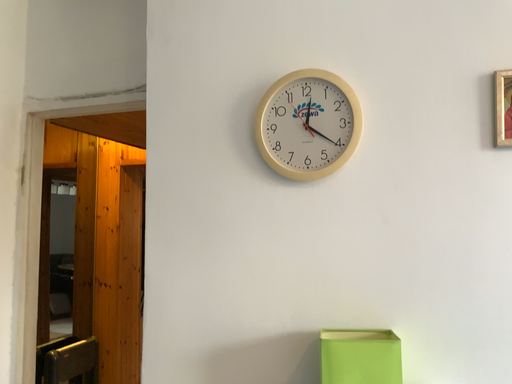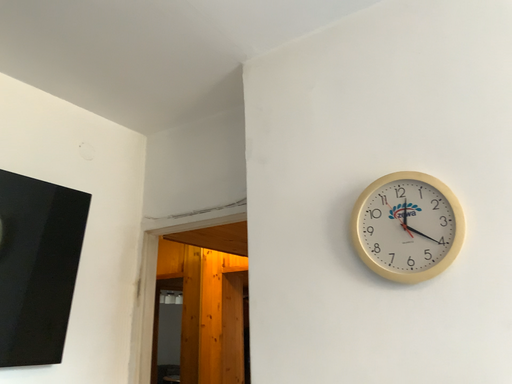
Question: Which way did the camera rotate in the video?

Choices:
 (A) rotated left
 (B) rotated right

Answer: (A)